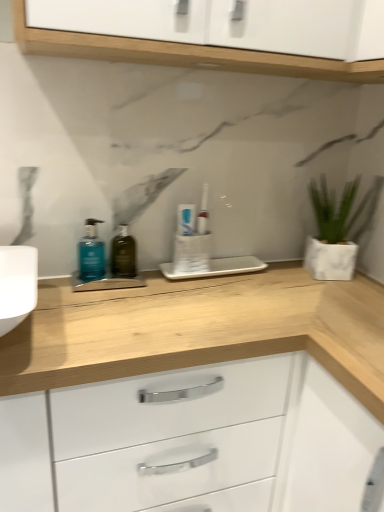
Where is `white matte pot at right`? white matte pot at right is located at coordinates (333, 231).

I want to click on green glass bottle at center, so click(123, 254).

From the image's perspective, relative to teal matte pump bottle at left, is white matte pot at right above or below?

From the image's perspective, white matte pot at right appears above teal matte pump bottle at left.

Considering the positions of objects white matte pot at right and teal matte pump bottle at left in the image provided, who is behind, white matte pot at right or teal matte pump bottle at left?

white matte pot at right is further from the camera.

Considering the relative sizes of white matte pot at right and teal matte pump bottle at left in the image provided, is white matte pot at right wider than teal matte pump bottle at left?

Yes.

Considering the relative positions of white matte pot at right and teal matte pump bottle at left in the image provided, is white matte pot at right to the right of teal matte pump bottle at left from the viewer's perspective?

Yes.

Does white matte pot at right contain green glass bottle at center?

No, white matte pot at right does not contain green glass bottle at center.

Based on the photo, is green glass bottle at center at the back of white matte pot at right?

No, white matte pot at right is not facing the opposite direction of green glass bottle at center.

From the image's perspective, which is above, white matte pot at right or green glass bottle at center?

From the image's view, white matte pot at right is above.

Is teal matte pump bottle at left positioned in front of white matte pot at right?

Yes, the depth of teal matte pump bottle at left is less than that of white matte pot at right.

Which is correct: teal matte pump bottle at left is inside white matte pot at right, or outside of it?

The correct answer is: outside.

From a real-world perspective, is teal matte pump bottle at left located beneath white matte pot at right?

Yes.

Does white glossy toothpaste at center have a larger size compared to green glass bottle at center?

No, white glossy toothpaste at center is not bigger than green glass bottle at center.

Are white glossy toothpaste at center and green glass bottle at center located far from each other?

No, white glossy toothpaste at center is not far away from green glass bottle at center.

From the picture: Which point is more forward, [194,215] or [111,258]?

The point [194,215] is in front.

From the image's perspective, between white glossy toothpaste at center and green glass bottle at center, which one is located above?

white glossy toothpaste at center is shown above in the image.

Is point (123, 262) positioned after point (80, 256)?

Yes.

Does green glass bottle at center turn towards teal matte pump bottle at left?

No.

Can you confirm if green glass bottle at center is smaller than teal matte pump bottle at left?

Incorrect, green glass bottle at center is not smaller in size than teal matte pump bottle at left.

Is white matte pot at right placed right next to white glossy toothpaste at center?

No, white matte pot at right is not making contact with white glossy toothpaste at center.

How different are the orientations of white matte pot at right and white glossy toothpaste at center in degrees?

15.2 degrees separate the facing orientations of white matte pot at right and white glossy toothpaste at center.

Does white matte pot at right appear on the left side of white glossy toothpaste at center?

In fact, white matte pot at right is to the right of white glossy toothpaste at center.

Locate an element on the screen. toothpaste on the left of white matte pot at right is located at coordinates (186, 219).

Between point (190, 222) and point (345, 268), which one is positioned behind?

Positioned behind is point (345, 268).

Is white glossy toothpaste at center turned away from white matte pot at right?

No, white glossy toothpaste at center is not facing away from white matte pot at right.

Which is more to the right, white glossy toothpaste at center or white matte pot at right?

Positioned to the right is white matte pot at right.

In the scene shown: Is white glossy toothpaste at center situated inside white matte pot at right or outside?

The correct answer is: outside.

The width and height of the screenshot is (384, 512). What are the coordinates of `houseplant located above the teal matte pump bottle at left (from a real-world perspective)` in the screenshot? It's located at (333, 231).

Image resolution: width=384 pixels, height=512 pixels. Find the location of `houseplant on the right of green glass bottle at center`. houseplant on the right of green glass bottle at center is located at coordinates (333, 231).

From the image, which object appears to be farther from white matte pot at right, white glossy toothpaste at center or green glass bottle at center?

green glass bottle at center is further to white matte pot at right.

Based on their spatial positions, is teal matte pump bottle at left or white matte pot at right further from green glass bottle at center?

Based on the image, white matte pot at right appears to be further to green glass bottle at center.

From the image, which object appears to be farther from white glossy toothpaste at center, teal matte pump bottle at left or white matte pot at right?

white matte pot at right lies further to white glossy toothpaste at center than the other object.

Looking at the image, which one is located further to teal matte pump bottle at left, green glass bottle at center or white glossy toothpaste at center?

white glossy toothpaste at center is further to teal matte pump bottle at left.

Based on their spatial positions, is green glass bottle at center or white matte pot at right closer to teal matte pump bottle at left?

Among the two, green glass bottle at center is located nearer to teal matte pump bottle at left.

Consider the image. Which object lies further to the anchor point white matte pot at right, white glossy toothpaste at center or teal matte pump bottle at left?

teal matte pump bottle at left lies further to white matte pot at right than the other object.

From the image, which object appears to be farther from teal matte pump bottle at left, white glossy toothpaste at center or white matte pot at right?

white matte pot at right lies further to teal matte pump bottle at left than the other object.

When comparing their distances from green glass bottle at center, does white glossy toothpaste at center or white matte pot at right seem further?

The object further to green glass bottle at center is white matte pot at right.

You are a GUI agent. You are given a task and a screenshot of the screen. Output one action in this format:
    pyautogui.click(x=<x>, y=<y>)
    Task: Click on the mouthwash between teal matte pump bottle at left and white matte pot at right in the horizontal direction
    The height and width of the screenshot is (512, 384).
    Given the screenshot: What is the action you would take?
    pyautogui.click(x=123, y=254)

Where is `toothpaste between green glass bottle at center and white matte pot at right`? toothpaste between green glass bottle at center and white matte pot at right is located at coordinates (186, 219).

Identify the location of mouthwash between teal matte pump bottle at left and white glossy toothpaste at center in the horizontal direction. (123, 254).

Identify the location of toothpaste between teal matte pump bottle at left and white matte pot at right in the horizontal direction. (186, 219).